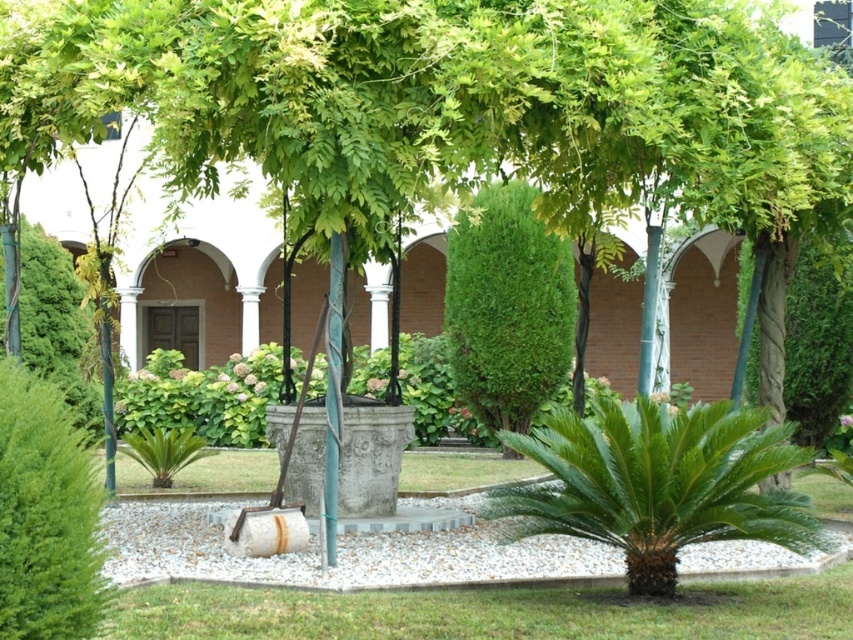
Can you confirm if green leafy palm at center is positioned to the right of green leafy bush at lower left?

Correct, you'll find green leafy palm at center to the right of green leafy bush at lower left.

Who is more distant from viewer, (804,460) or (13,417)?

Positioned behind is point (804,460).

Locate an element on the screen. The width and height of the screenshot is (853, 640). green leafy palm at center is located at coordinates (659, 483).

This screenshot has height=640, width=853. What do you see at coordinates (817, 339) in the screenshot?
I see `green textured bush at center` at bounding box center [817, 339].

What do you see at coordinates (817, 339) in the screenshot? I see `green textured bush at center` at bounding box center [817, 339].

This screenshot has width=853, height=640. Identify the location of green textured bush at center. [817, 339].

Can you confirm if white gravel at center is taller than green leafy bush at center?

No, white gravel at center is not taller than green leafy bush at center.

Is white gravel at center wider than green leafy bush at center?

Incorrect, white gravel at center's width does not surpass green leafy bush at center's.

Who is more forward, (549,579) or (489,196)?

Point (549,579)

Identify the location of white gravel at center. (339, 554).